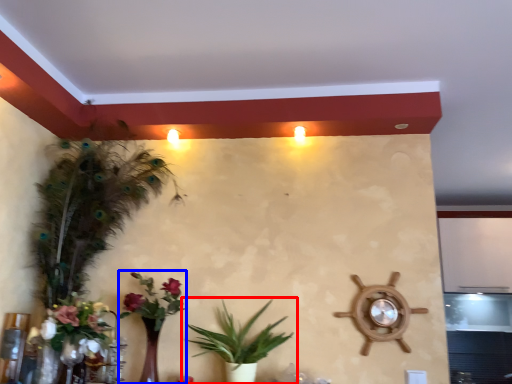
Question: Which object appears farthest to the camera in this image, houseplant (highlighted by a red box) or floral arrangement (highlighted by a blue box)?

Choices:
 (A) houseplant
 (B) floral arrangement

Answer: (B)